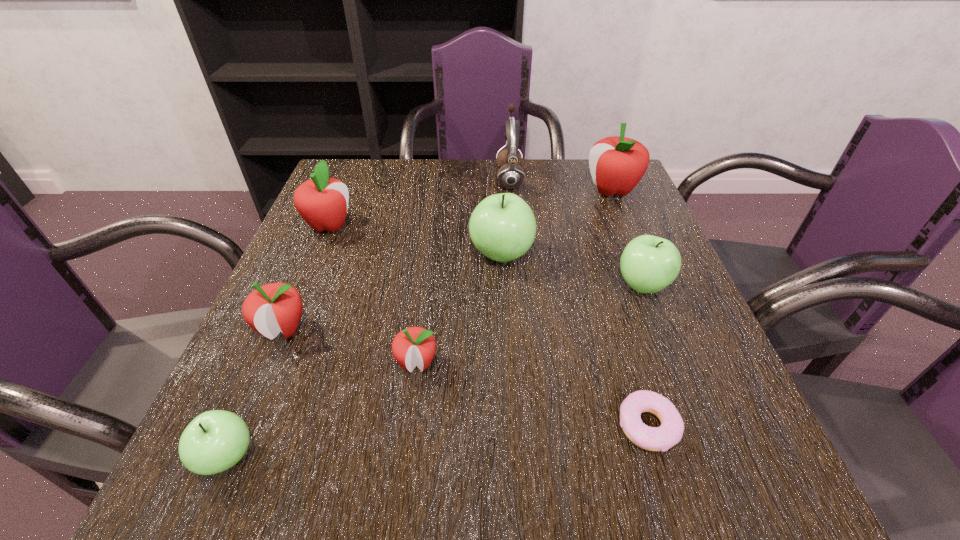
Where is `vacant space in between the third biggest red apple and the second smallest green apple`? The image size is (960, 540). vacant space in between the third biggest red apple and the second smallest green apple is located at coordinates (463, 307).

Find the location of `vacant area that lies between the pink doughnut and the farthest red apple`. vacant area that lies between the pink doughnut and the farthest red apple is located at coordinates (630, 308).

I want to click on vacant area that lies between the smallest red apple and the farthest red apple, so click(x=515, y=277).

You are a GUI agent. You are given a task and a screenshot of the screen. Output one action in this format:
    pyautogui.click(x=<x>, y=<y>)
    Task: Click on the free space between the brown earphone and the third smallest red apple
    
    Given the screenshot: What is the action you would take?
    pyautogui.click(x=420, y=202)

Locate an element on the screen. The width and height of the screenshot is (960, 540). free space between the fifth apple from left to right and the farthest red apple is located at coordinates (557, 222).

Identify the location of vacant area between the leftmost green apple and the biggest green apple. click(364, 356).

Find the location of a particular element. free point between the nearest apple and the fourth apple from right to left is located at coordinates (322, 410).

Where is `free spot between the second red apple from right to left and the second smallest red apple`? This screenshot has width=960, height=540. free spot between the second red apple from right to left and the second smallest red apple is located at coordinates (350, 346).

Point out which object is positioned as the nearest to the fourth apple from left to right. Please provide its 2D coordinates. Your answer should be formatted as a tuple, i.e. [(x, y)], where the tuple contains the x and y coordinates of a point satisfying the conditions above.

[(270, 309)]

The height and width of the screenshot is (540, 960). I want to click on the second closest object to the second biggest red apple, so click(x=502, y=227).